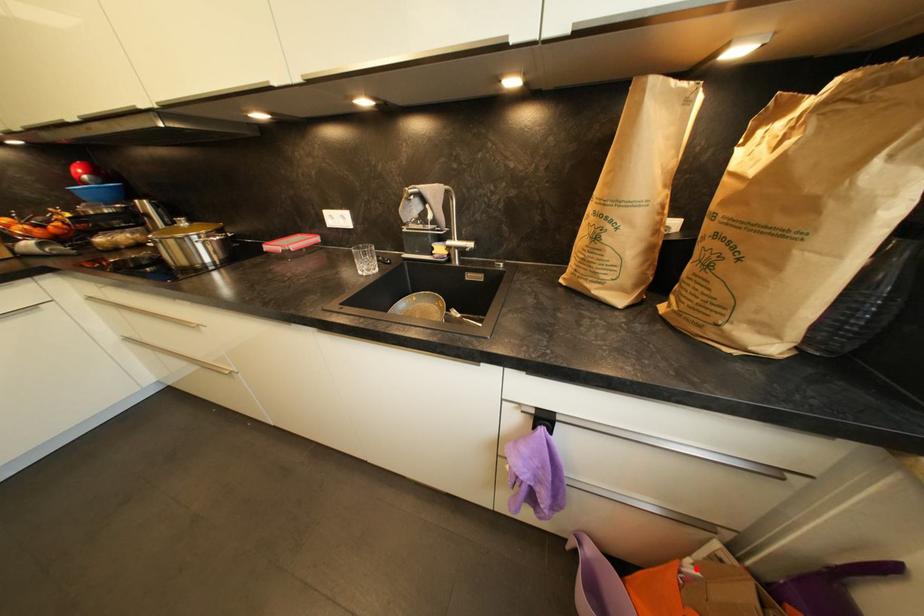
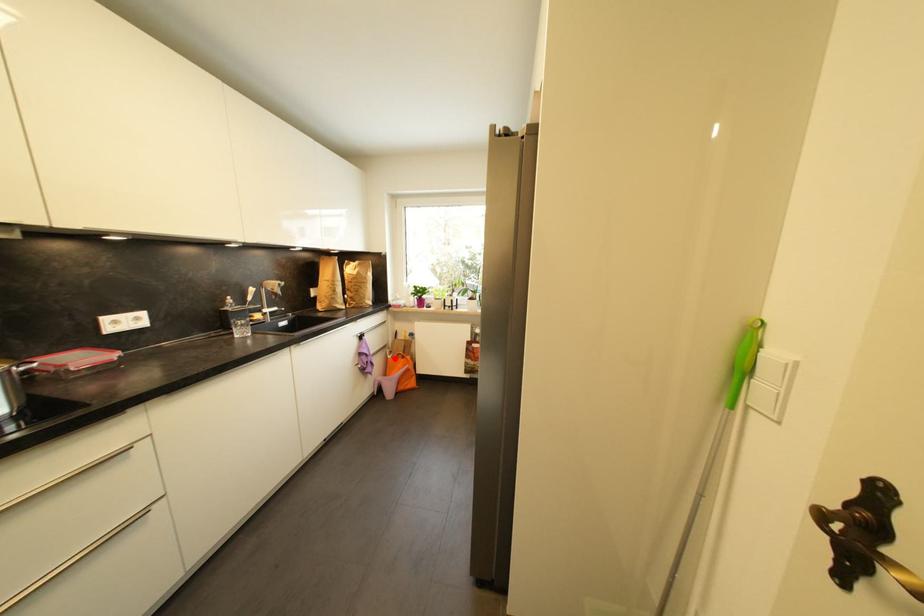
I am providing you with two images of the same scene from different viewpoints. A red point is marked on the first image and another point is marked on the second image. Are the points marked in image1 and image2 representing the same 3D position?

Yes